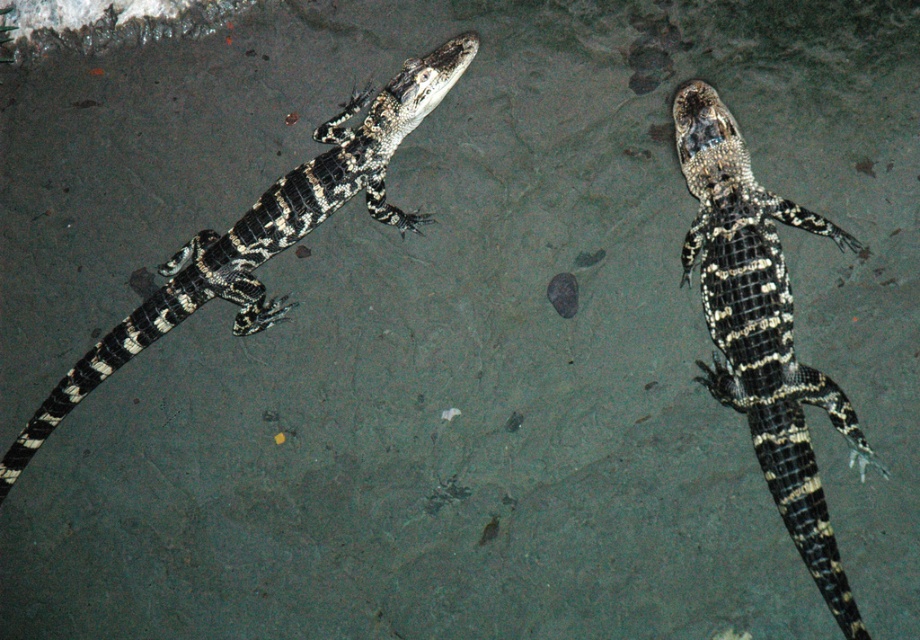
Is point (805, 554) positioned behind point (415, 120)?

No, (805, 554) is in front of (415, 120).

Which of these two, shiny black scales at upper right or shiny black scales at left, stands taller?

shiny black scales at upper right

Describe the element at coordinates (762, 330) in the screenshot. I see `shiny black scales at upper right` at that location.

The image size is (920, 640). I want to click on shiny black scales at upper right, so click(x=762, y=330).